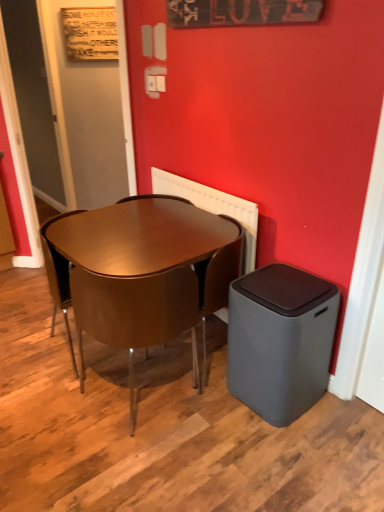
Identify the location of free space between matte brown table at center and gray matte trash bin at lower right. This screenshot has height=512, width=384. (216, 416).